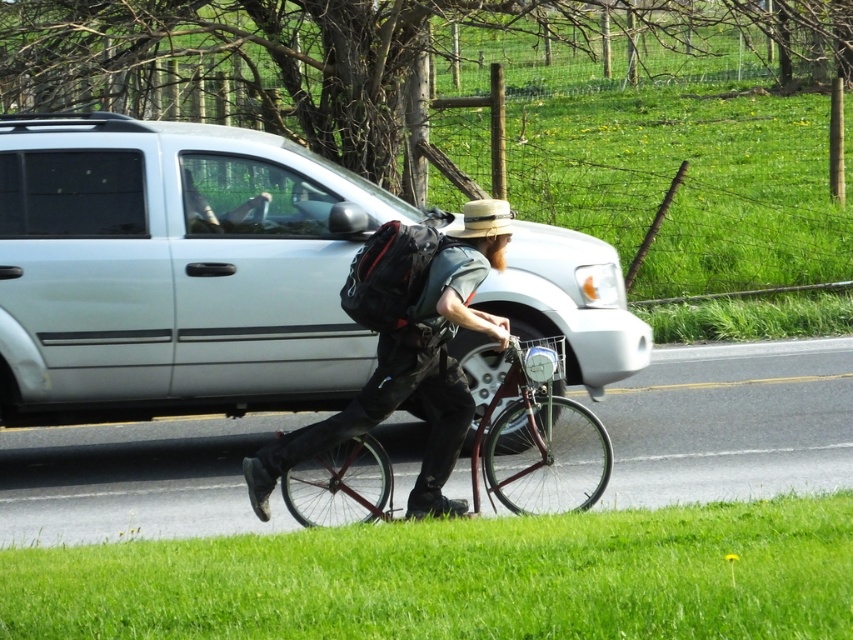
You are taking a photo of the cyclist and their bicycle. You want to focus on the point closer to the camera. Which point should you choose between point (67, 378) and point (546, 509)?

Point (67, 378) is further to the camera than point (546, 509), so you should choose point (67, 378) to focus on the closer point.